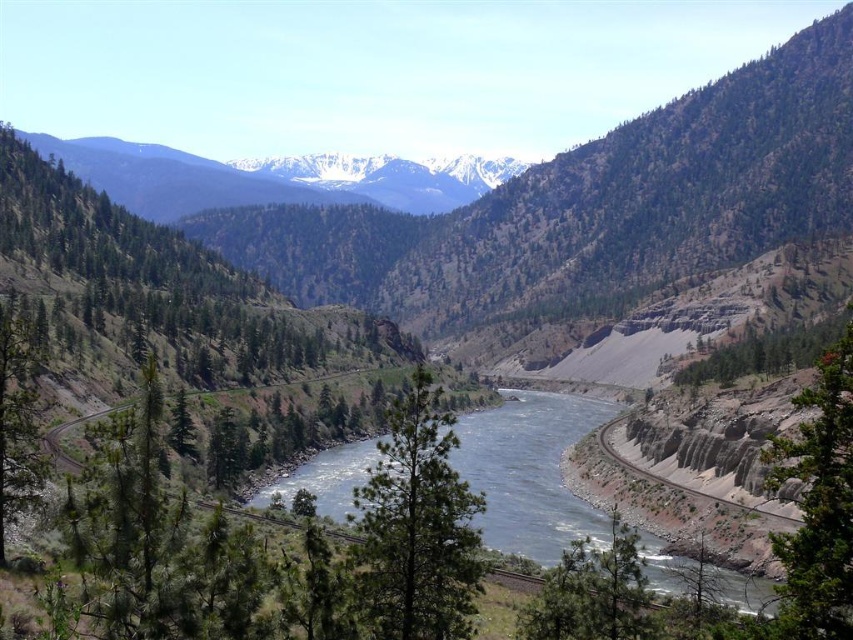
You are an environmental scientist assessing the landscape. You observe the snowy white mountain range at upper center and the green textured tree at left. Which object has a greater height?

The snowy white mountain range at upper center is much taller than the green textured tree at left.